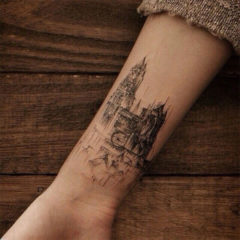
Where is `wood table`? The height and width of the screenshot is (240, 240). wood table is located at coordinates (154, 230).